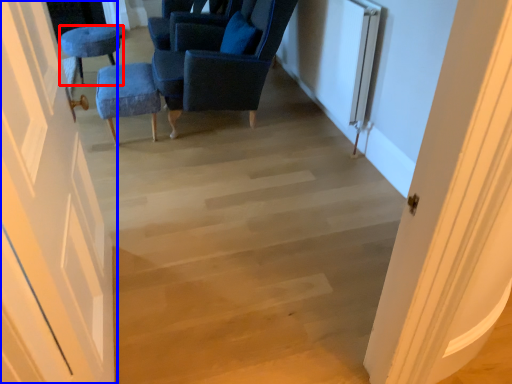
Question: Which of the following is the farthest to the observer, furniture (highlighted by a red box) or door (highlighted by a blue box)?

Choices:
 (A) furniture
 (B) door

Answer: (A)